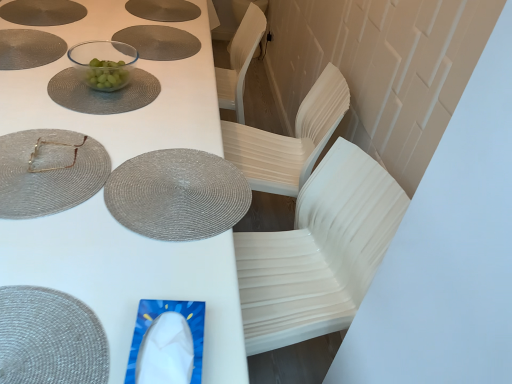
Question: In which direction should I rotate to look at clear glass bowl at upper center, marked as the 1th tableware in a top-to-bottom arrangement?

Choices:
 (A) right
 (B) left

Answer: (B)

Question: Is the surface of matte woven placemat at upper left, positioned as the second glass plate in back-to-front order, in direct contact with rattan placemat at lower left, arranged as the fourth tableware when viewed from the back?

Choices:
 (A) yes
 (B) no

Answer: (B)

Question: Is matte woven placemat at upper left, positioned as the second glass plate in back-to-front order, aimed at rattan placemat at lower left, arranged as the fourth tableware when viewed from the back?

Choices:
 (A) no
 (B) yes

Answer: (A)

Question: From a real-world perspective, is matte woven placemat at upper left, which is the 2th glass plate from top to bottom, under rattan placemat at lower left, the first tableware ordered from the bottom?

Choices:
 (A) no
 (B) yes

Answer: (A)

Question: Can you confirm if matte woven placemat at upper left, positioned as the second glass plate in back-to-front order, is positioned to the left of rattan placemat at lower left, arranged as the fourth tableware when viewed from the back?

Choices:
 (A) yes
 (B) no

Answer: (A)

Question: From the image's perspective, would you say matte woven placemat at upper left, marked as the 1th glass plate in a front-to-back arrangement, is shown under rattan placemat at lower left, the first tableware ordered from the bottom?

Choices:
 (A) yes
 (B) no

Answer: (B)

Question: From the image's perspective, is matte woven placemat at upper left, which is the 2th glass plate from top to bottom, on rattan placemat at lower left, the 1th tableware when ordered from front to back?

Choices:
 (A) yes
 (B) no

Answer: (A)

Question: Is matte gray placemat at upper center, which is the 1th platter from right to left, oriented towards matte silver placemat at upper left, the 2th platter viewed from the right?

Choices:
 (A) no
 (B) yes

Answer: (A)

Question: Is matte gray placemat at upper center, which is the 1th platter from right to left, shorter than matte silver placemat at upper left, the 2th platter viewed from the right?

Choices:
 (A) yes
 (B) no

Answer: (A)

Question: Considering the relative positions of matte gray placemat at upper center, which is the 1th platter from right to left, and matte silver placemat at upper left, the 2th platter viewed from the right, in the image provided, is matte gray placemat at upper center, which is the 1th platter from right to left, to the right of matte silver placemat at upper left, the 2th platter viewed from the right, from the viewer's perspective?

Choices:
 (A) no
 (B) yes

Answer: (B)

Question: From the image's perspective, is matte gray placemat at upper center, which is counted as the 2th platter, starting from the left, located beneath matte silver placemat at upper left, the 1th platter in the left-to-right sequence?

Choices:
 (A) no
 (B) yes

Answer: (A)

Question: Is matte gray placemat at upper center, which is counted as the 2th platter, starting from the left, positioned behind matte silver placemat at upper left, the 2th platter viewed from the right?

Choices:
 (A) no
 (B) yes

Answer: (B)

Question: Is matte gray placemat at upper center, which is counted as the 2th platter, starting from the left, thinner than matte silver placemat at upper left, the 2th platter viewed from the right?

Choices:
 (A) no
 (B) yes

Answer: (B)

Question: From a real-world perspective, is white plastic table at center located beneath clear glass bowl at upper center, which appears as the fourth tableware when viewed from the front?

Choices:
 (A) yes
 (B) no

Answer: (A)